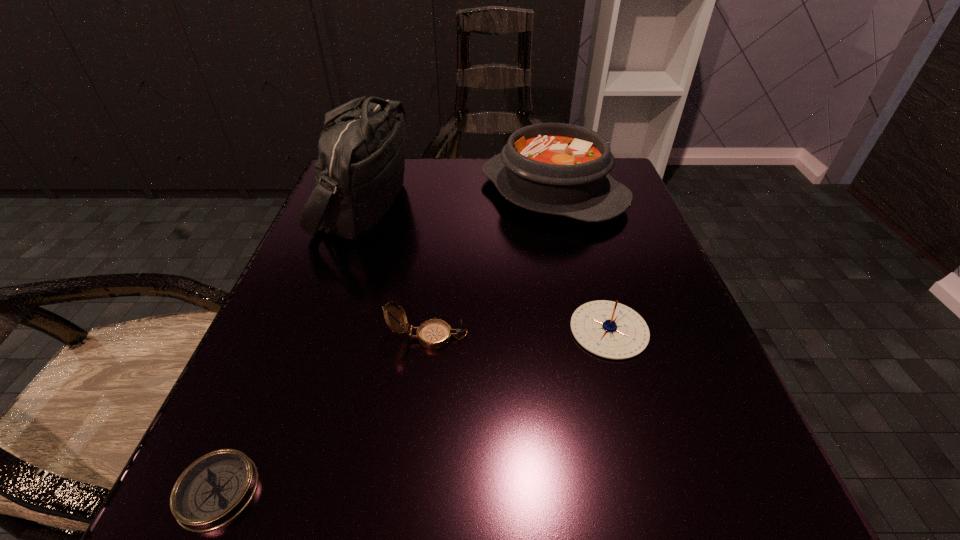
Identify the location of vacant space located 0.280m on the back of the nearest compass. (303, 290).

This screenshot has width=960, height=540. Find the location of `shoulder bag present at the far edge`. shoulder bag present at the far edge is located at coordinates (360, 169).

You are a GUI agent. You are given a task and a screenshot of the screen. Output one action in this format:
    pyautogui.click(x=<x>, y=<y>)
    Task: Click on the casserole that is at the far edge
    
    Given the screenshot: What is the action you would take?
    pyautogui.click(x=562, y=169)

This screenshot has height=540, width=960. In order to click on object that is positioned at the near edge in this screenshot , I will do `click(216, 488)`.

Find the location of a particular element. The image size is (960, 540). shoulder bag positioned at the left edge is located at coordinates (360, 169).

I want to click on compass that is at the left edge, so click(x=216, y=488).

Locate an element on the screen. Image resolution: width=960 pixels, height=540 pixels. casserole that is at the right edge is located at coordinates (562, 169).

Locate an element on the screen. Image resolution: width=960 pixels, height=540 pixels. compass located at the right edge is located at coordinates (608, 329).

Locate an element on the screen. object that is at the far left corner is located at coordinates (360, 169).

Find the location of a particular element. Image resolution: width=960 pixels, height=540 pixels. object that is at the near left corner is located at coordinates click(x=216, y=488).